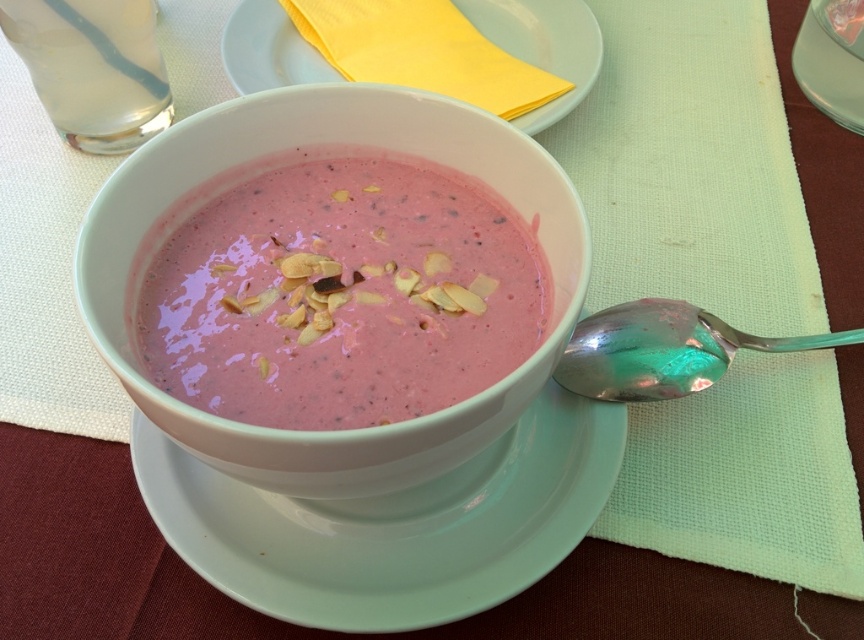
Question: Which is nearer to the silver metallic spoon at lower right?

Choices:
 (A) white glossy plate at center
 (B) matte ceramic bowl at center
 (C) white ceramic plate at upper center

Answer: (A)

Question: Is matte ceramic bowl at center to the right of silver metallic spoon at lower right from the viewer's perspective?

Choices:
 (A) no
 (B) yes

Answer: (A)

Question: Which point is farther to the camera?

Choices:
 (A) (577, 45)
 (B) (348, 500)
 (C) (596, 371)

Answer: (A)

Question: Considering the relative positions of matte ceramic bowl at center and white ceramic plate at upper center in the image provided, where is matte ceramic bowl at center located with respect to white ceramic plate at upper center?

Choices:
 (A) above
 (B) below

Answer: (B)

Question: From the image, what is the correct spatial relationship of white glossy plate at center in relation to silver metallic spoon at lower right?

Choices:
 (A) right
 (B) left

Answer: (B)

Question: Which of these objects is positioned farthest from the white glossy plate at center?

Choices:
 (A) white ceramic plate at upper center
 (B) matte ceramic bowl at center
 (C) silver metallic spoon at lower right

Answer: (A)